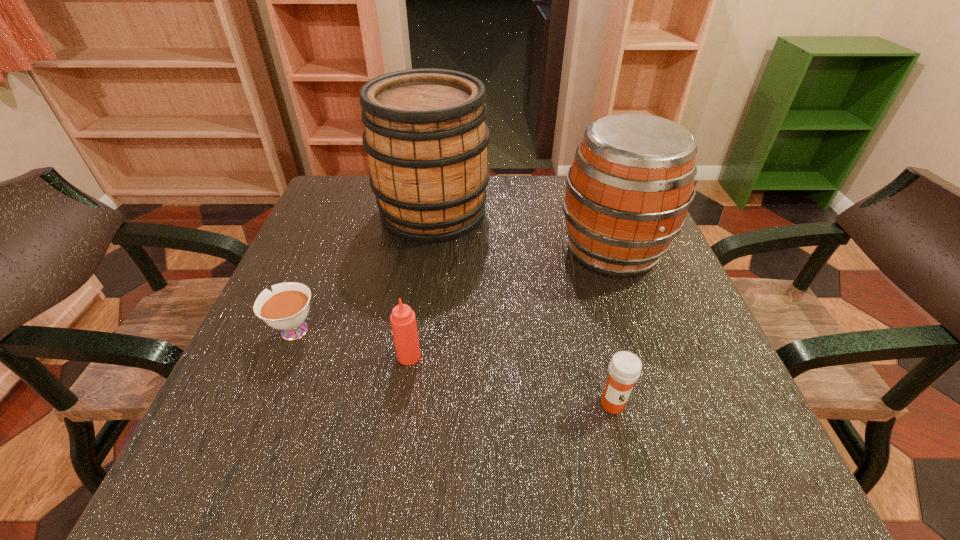
I want to click on vacant region between the leftmost object and the medicine, so click(x=452, y=368).

Identify which object is located as the third nearest to the medicine. Please provide its 2D coordinates. Your answer should be formatted as a tuple, i.e. [(x, y)], where the tuple contains the x and y coordinates of a point satisfying the conditions above.

[(426, 138)]

Find the location of `the closest object to the leftmost object`. the closest object to the leftmost object is located at coordinates (403, 320).

Identify the location of free spot that satisfies the following two spatial constraints: 1. on the front side of the left cider; 2. on the side of the teacup with the handle. The width and height of the screenshot is (960, 540). 417,331.

Where is `vacant area in the image that satisfies the following two spatial constraints: 1. on the side of the teacup with the handle; 2. on the right side of the third shortest object`? The height and width of the screenshot is (540, 960). vacant area in the image that satisfies the following two spatial constraints: 1. on the side of the teacup with the handle; 2. on the right side of the third shortest object is located at coordinates (281, 356).

The image size is (960, 540). Identify the location of vacant area in the image that satisfies the following two spatial constraints: 1. on the side of the shortest object with the handle; 2. on the left side of the third tallest object. (281, 356).